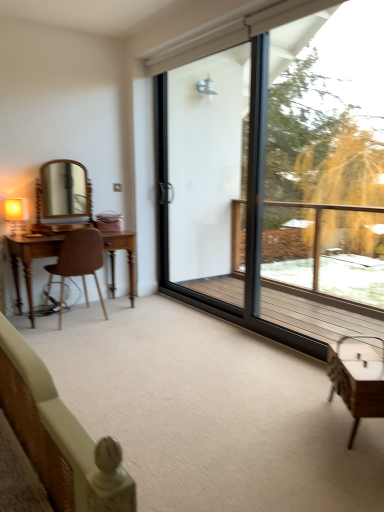
Find the location of a particular element. free space to the right of brown leather chair at left is located at coordinates (137, 317).